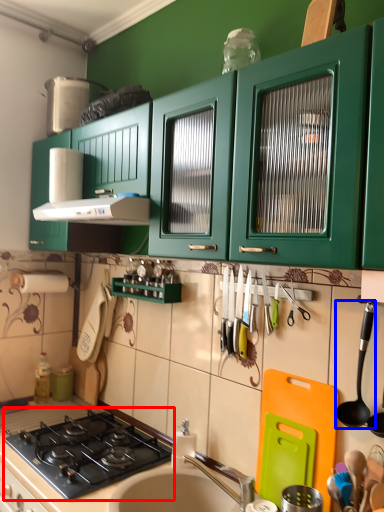
Question: Among these objects, which one is nearest to the camera, gas stove (highlighted by a red box) or utensil (highlighted by a blue box)?

Choices:
 (A) gas stove
 (B) utensil

Answer: (B)